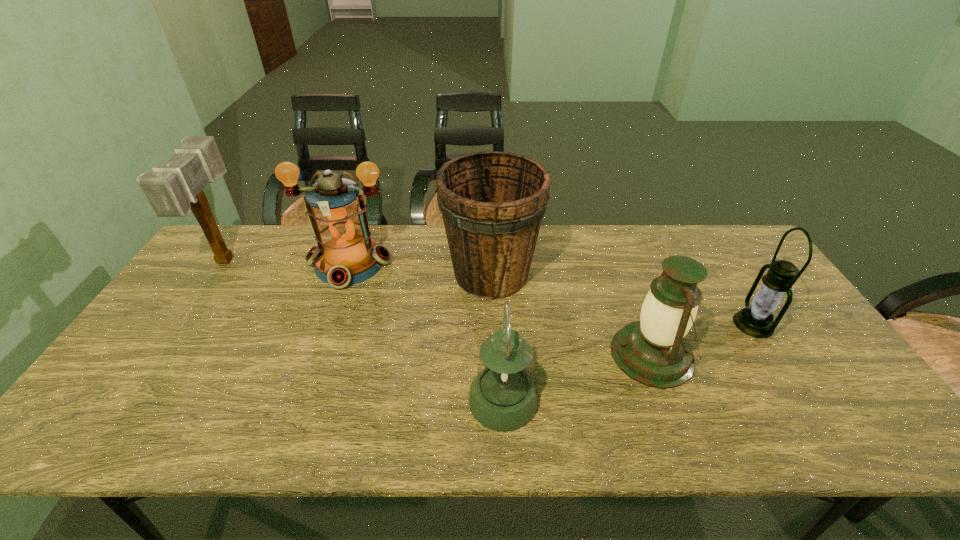
The width and height of the screenshot is (960, 540). What are the coordinates of `the leftmost object` in the screenshot? It's located at (174, 189).

I want to click on the fifth object from right to left, so click(345, 255).

Where is `the farthest lantern`? Image resolution: width=960 pixels, height=540 pixels. the farthest lantern is located at coordinates click(345, 255).

Find the location of a particular element. This screenshot has width=960, height=540. bucket is located at coordinates (492, 203).

Where is `the rightmost object`? The image size is (960, 540). the rightmost object is located at coordinates (756, 320).

What are the coordinates of `the fifth object from left to right` in the screenshot? It's located at (653, 351).

Find the location of a particular element. This screenshot has width=960, height=540. the third lantern from right to left is located at coordinates (503, 397).

Locate an element on the screen. vacant position located on the right of the leftmost object is located at coordinates (328, 260).

Identify the location of vacant space situated on the front-facing side of the leftmost lantern. (305, 389).

Locate an element on the screen. This screenshot has width=960, height=540. vacant space positioned 0.300m on the front of the bucket is located at coordinates pos(495,400).